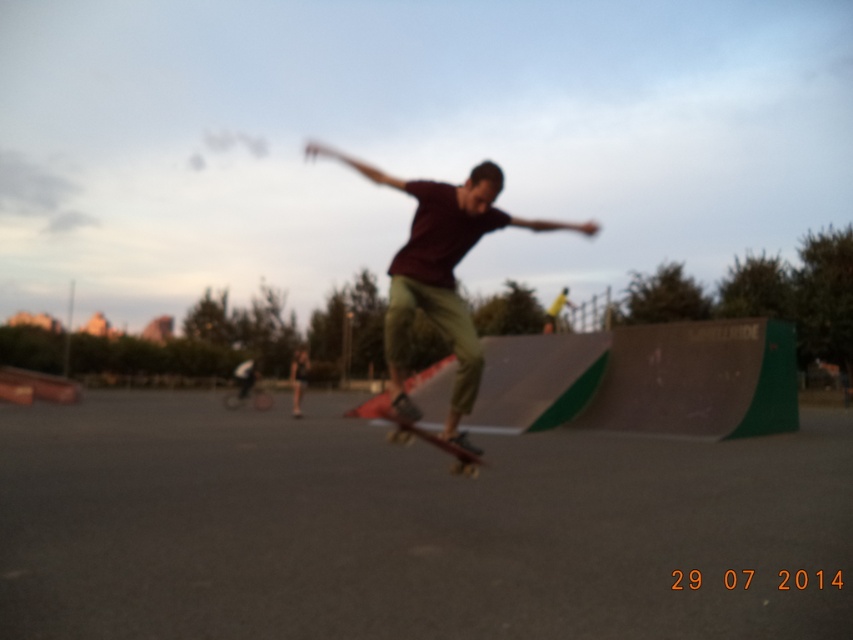
Does matte black skateboard at center have a lesser height compared to wooden skateboard at center?

In fact, matte black skateboard at center may be taller than wooden skateboard at center.

Does point (427, 189) lie in front of point (399, 440)?

Yes.

I want to click on matte black skateboard at center, so click(440, 275).